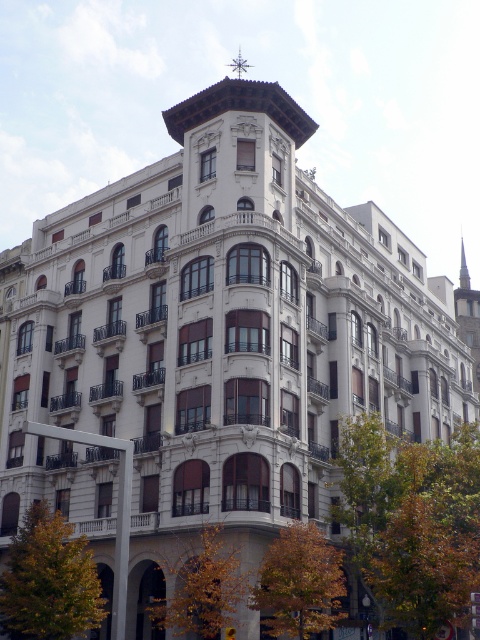
Question: Is brown leafy tree at lower right thinner than green leafy tree at lower left?

Choices:
 (A) yes
 (B) no

Answer: (A)

Question: Observing the image, what is the correct spatial positioning of green leafy tree at lower right in reference to orange leafy tree at lower center?

Choices:
 (A) above
 (B) below

Answer: (A)

Question: Does brown leafy tree at lower right have a greater width compared to yellow leafy tree at lower center?

Choices:
 (A) yes
 (B) no

Answer: (B)

Question: Which point is closer to the camera?

Choices:
 (A) yellow leafy tree at lower center
 (B) green leafy tree at lower left
 (C) orange leafy tree at lower center

Answer: (C)

Question: Which object is the closest to the orange leafy tree at lower center?

Choices:
 (A) brown leafy tree at lower right
 (B) green leafy tree at lower right
 (C) yellow leafy tree at lower center

Answer: (C)

Question: Which point appears closest to the camera in this image?

Choices:
 (A) (63, 611)
 (B) (450, 605)

Answer: (B)